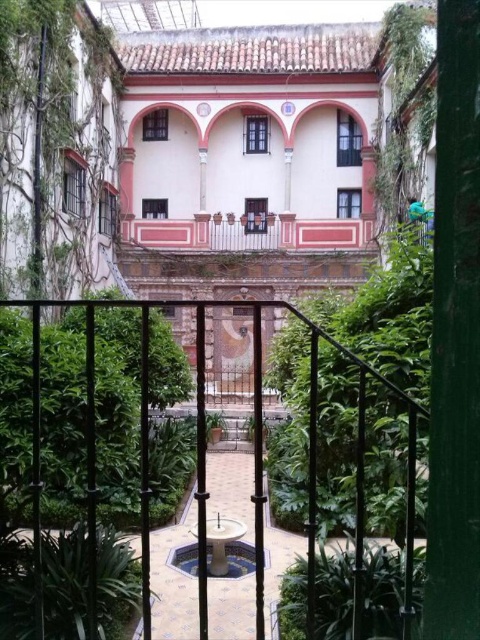
Is black metal fence at center positioned behind green leafy plant at lower left?

No.

Is black metal fence at center above green leafy plant at lower left?

Yes, black metal fence at center is above green leafy plant at lower left.

Who is more distant from viewer, [197,432] or [101,605]?

Point [101,605]

Find the location of a particular element. black metal fence at center is located at coordinates (314, 477).

Can you confirm if green leafy plant at lower left is taller than green leafy plant at center?

Incorrect, green leafy plant at lower left's height is not larger of green leafy plant at center's.

Does point (110, 529) come behind point (291, 593)?

Yes, it is.

Where is `green leafy plant at lower left`? This screenshot has height=640, width=480. green leafy plant at lower left is located at coordinates (64, 582).

Which is below, black metal fence at center or green leafy plant at center?

green leafy plant at center is lower down.

Which is behind, point (34, 403) or point (369, 600)?

Point (369, 600)

Identify the location of black metal fence at center. The width and height of the screenshot is (480, 640). (314, 477).